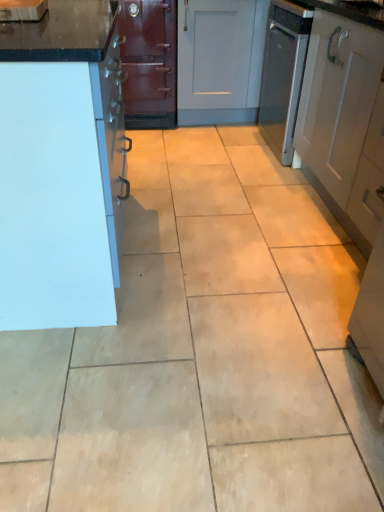
Question: From the image's perspective, relative to white matte cabinet at left, which appears as the second cabinetry when viewed from the right, is white matte cabinet at right, positioned as the 2th cabinetry in left-to-right order, above or below?

Choices:
 (A) above
 (B) below

Answer: (A)

Question: Is white matte cabinet at right, which is the first cabinetry from right to left, to the left or to the right of white matte cabinet at left, which appears as the second cabinetry when viewed from the right, in the image?

Choices:
 (A) left
 (B) right

Answer: (B)

Question: In the image, is white matte cabinet at right, positioned as the 2th cabinetry in left-to-right order, positioned in front of or behind white matte cabinet at left, the 1th cabinetry from the left?

Choices:
 (A) behind
 (B) front

Answer: (A)

Question: Is white matte cabinet at left, which appears as the second cabinetry when viewed from the right, taller or shorter than white matte cabinet at right, which is the first cabinetry from right to left?

Choices:
 (A) tall
 (B) short

Answer: (B)

Question: Looking at their shapes, would you say white matte cabinet at left, which appears as the second cabinetry when viewed from the right, is wider or thinner than white matte cabinet at right, positioned as the 2th cabinetry in left-to-right order?

Choices:
 (A) wide
 (B) thin

Answer: (A)

Question: From the image's perspective, is white matte cabinet at left, the 1th cabinetry from the left, located above or below white matte cabinet at right, which is the first cabinetry from right to left?

Choices:
 (A) above
 (B) below

Answer: (B)

Question: Which is correct: white matte cabinet at left, which appears as the second cabinetry when viewed from the right, is inside white matte cabinet at right, positioned as the 2th cabinetry in left-to-right order, or outside of it?

Choices:
 (A) outside
 (B) inside

Answer: (A)